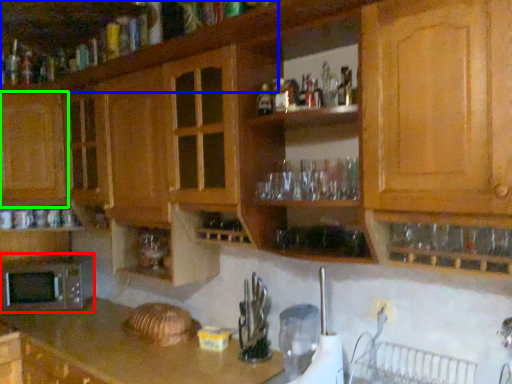
Question: Based on their relative distances, which object is nearer to microwave oven (highlighted by a red box)? Choose from cabinetry (highlighted by a blue box) and cabinetry (highlighted by a green box).

Choices:
 (A) cabinetry
 (B) cabinetry

Answer: (B)